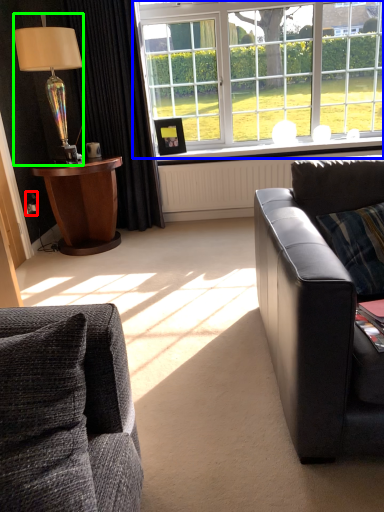
Question: Which object is positioned farthest from power outlet (highlighted by a red box)? Select from window (highlighted by a blue box) and lamp (highlighted by a green box).

Choices:
 (A) window
 (B) lamp

Answer: (A)